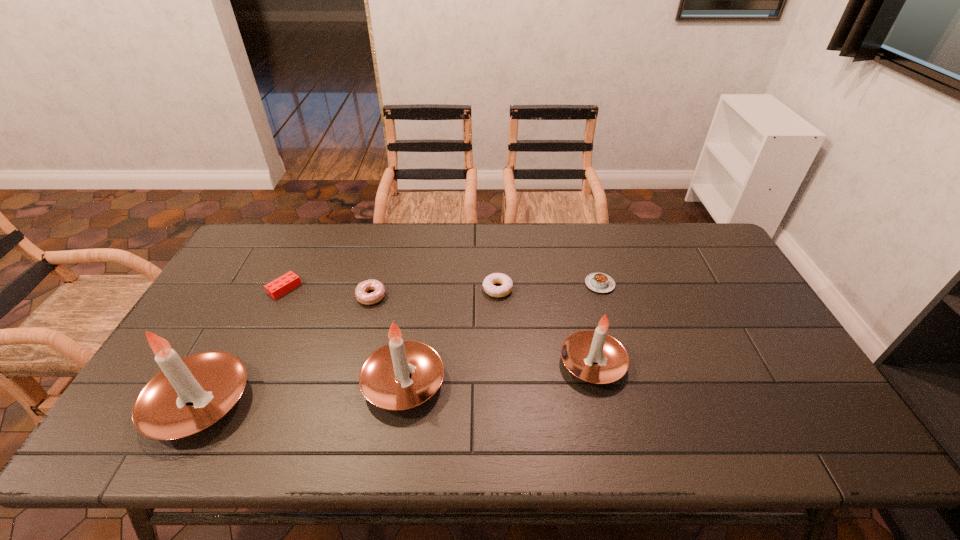
Find the location of a particular element. The height and width of the screenshot is (540, 960). the leftmost candle is located at coordinates (189, 394).

Find the location of `the second tallest object`. the second tallest object is located at coordinates (403, 374).

Find the location of `the second candle from left to right`. the second candle from left to right is located at coordinates (403, 374).

This screenshot has width=960, height=540. In order to click on the fifth shortest object in this screenshot , I will do `click(594, 356)`.

This screenshot has width=960, height=540. I want to click on the rightmost candle, so click(594, 356).

The height and width of the screenshot is (540, 960). In order to click on Lego in this screenshot , I will do `click(280, 286)`.

Identify the location of the third object from right to left. (x=496, y=278).

Identify the location of the left doughnut. (362, 296).

You are a GUI agent. You are given a task and a screenshot of the screen. Output one action in this format:
    pyautogui.click(x=<x>, y=<y>)
    Task: Click on the pudding
    
    Given the screenshot: What is the action you would take?
    pyautogui.click(x=599, y=282)

The width and height of the screenshot is (960, 540). I want to click on vacant position located 0.140m on the back of the leftmost candle, so click(x=242, y=322).